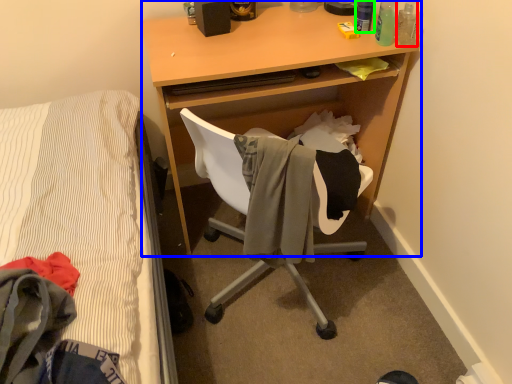
Question: Which is farther away from bottle (highlighted by a red box)? desk (highlighted by a blue box) or bottle (highlighted by a green box)?

Choices:
 (A) desk
 (B) bottle

Answer: (A)